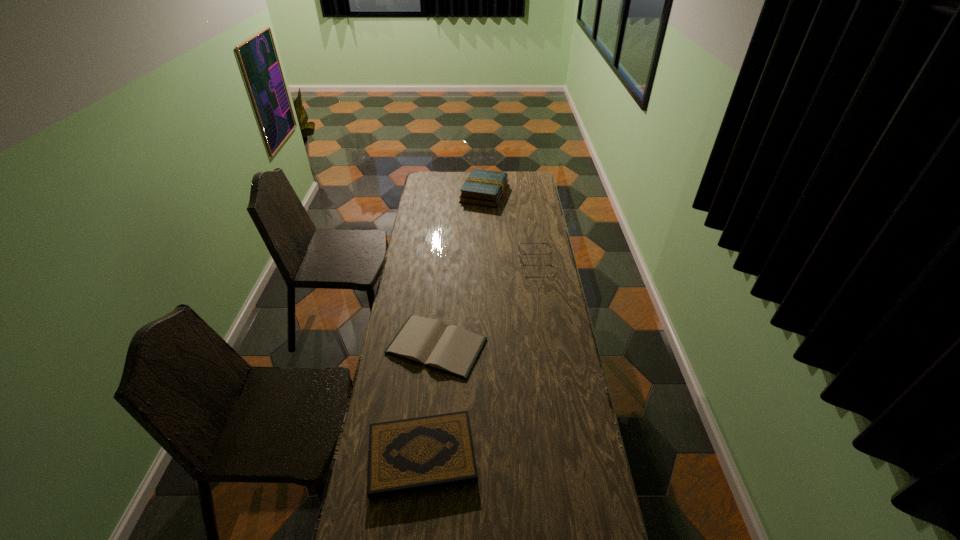
I want to click on the tallest object, so click(482, 187).

Where is `the tallest hardback book`? The height and width of the screenshot is (540, 960). the tallest hardback book is located at coordinates (482, 187).

This screenshot has width=960, height=540. Identify the location of spectacles. (519, 242).

The height and width of the screenshot is (540, 960). I want to click on the second farthest object, so click(x=519, y=242).

Identify the location of the third tallest object. Image resolution: width=960 pixels, height=540 pixels. point(419,454).

Locate an element on the screen. the nearest object is located at coordinates (419, 454).

Identify the location of the second nearest hardback book. The image size is (960, 540). (452, 349).

Image resolution: width=960 pixels, height=540 pixels. Find the location of `the shortest hardback book`. the shortest hardback book is located at coordinates (452, 349).

This screenshot has width=960, height=540. I want to click on vacant area located 0.150m on the front of the farthest object, so click(485, 223).

This screenshot has width=960, height=540. Find the location of `vacant space located on the front-facing side of the third shortest object`. vacant space located on the front-facing side of the third shortest object is located at coordinates (472, 259).